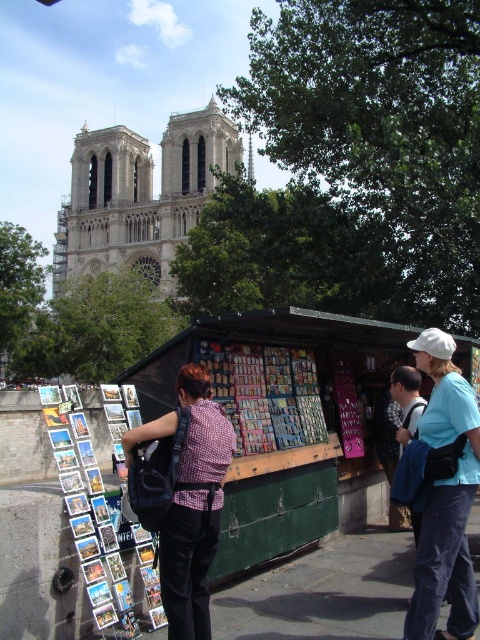
Between plaid shirt at center and matte white cap at upper right, which one has less height?

With less height is plaid shirt at center.

Can you confirm if plaid shirt at center is positioned to the right of matte white cap at upper right?

In fact, plaid shirt at center is to the left of matte white cap at upper right.

Between point (200, 422) and point (468, 502), which one is positioned behind?

Positioned behind is point (200, 422).

Where is `plaid shirt at center`? The width and height of the screenshot is (480, 640). plaid shirt at center is located at coordinates (182, 496).

Can you confirm if stone gothic cathedral at upper left is positioned to the left of matte white cap at upper right?

Yes, stone gothic cathedral at upper left is to the left of matte white cap at upper right.

Is point (78, 173) less distant than point (437, 525)?

No, it is not.

This screenshot has width=480, height=640. I want to click on stone gothic cathedral at upper left, so click(140, 195).

Is stone gothic cathedral at upper left behind plaid shirt at center?

Yes, stone gothic cathedral at upper left is behind plaid shirt at center.

Which is in front, point (180, 122) or point (167, 435)?

Point (167, 435) is in front.

Is point (222, 120) farther from camera compared to point (168, 628)?

Yes, it is behind point (168, 628).

This screenshot has height=640, width=480. Identify the location of stone gothic cathedral at upper left. (140, 195).